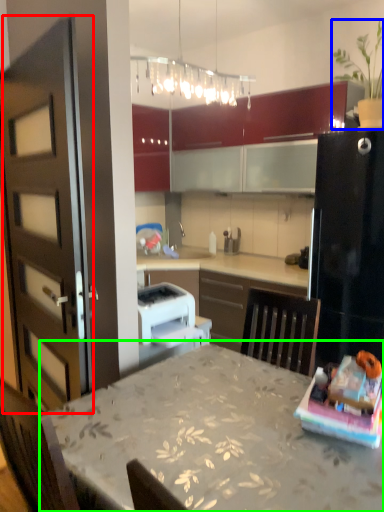
Question: Which is farther away from door (highlighted by a red box)? houseplant (highlighted by a blue box) or table (highlighted by a green box)?

Choices:
 (A) houseplant
 (B) table

Answer: (A)